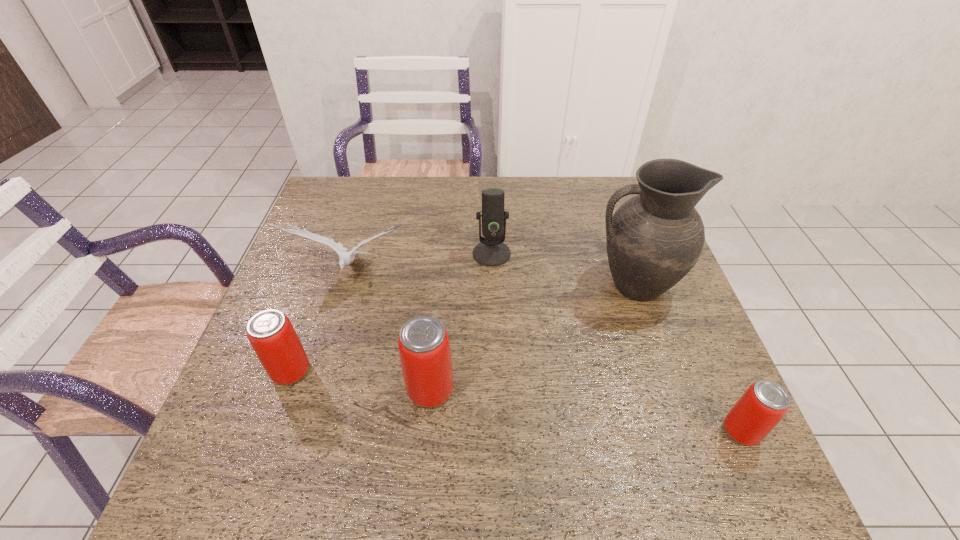
In order to click on free spot located 0.340m on the left of the microphone in this screenshot , I will do `click(351, 254)`.

The height and width of the screenshot is (540, 960). I want to click on vacant area situated at the tip of the beak of the gull, so click(x=309, y=419).

Where is `vacant space located 0.330m on the side of the tallest object with the handle`? vacant space located 0.330m on the side of the tallest object with the handle is located at coordinates (462, 285).

Where is `vacant region located on the side of the tallest object with the handle`? The width and height of the screenshot is (960, 540). vacant region located on the side of the tallest object with the handle is located at coordinates (516, 285).

Locate an element on the screen. The width and height of the screenshot is (960, 540). vacant space situated 0.380m on the side of the tallest object with the handle is located at coordinates (443, 285).

Locate an element on the screen. The height and width of the screenshot is (540, 960). beer can that is at the left edge is located at coordinates (270, 333).

Find the location of `gull situated at the left edge`. gull situated at the left edge is located at coordinates (345, 258).

Locate an element on the screen. The width and height of the screenshot is (960, 540). beer can at the right edge is located at coordinates (762, 406).

Image resolution: width=960 pixels, height=540 pixels. Identify the location of pitcher present at the right edge. (653, 240).

You are a GUI agent. You are given a task and a screenshot of the screen. Output one action in this format:
    pyautogui.click(x=<x>, y=<y>)
    Task: Click on the object present at the near right corner
    This screenshot has height=540, width=960.
    Given the screenshot: What is the action you would take?
    [762, 406]